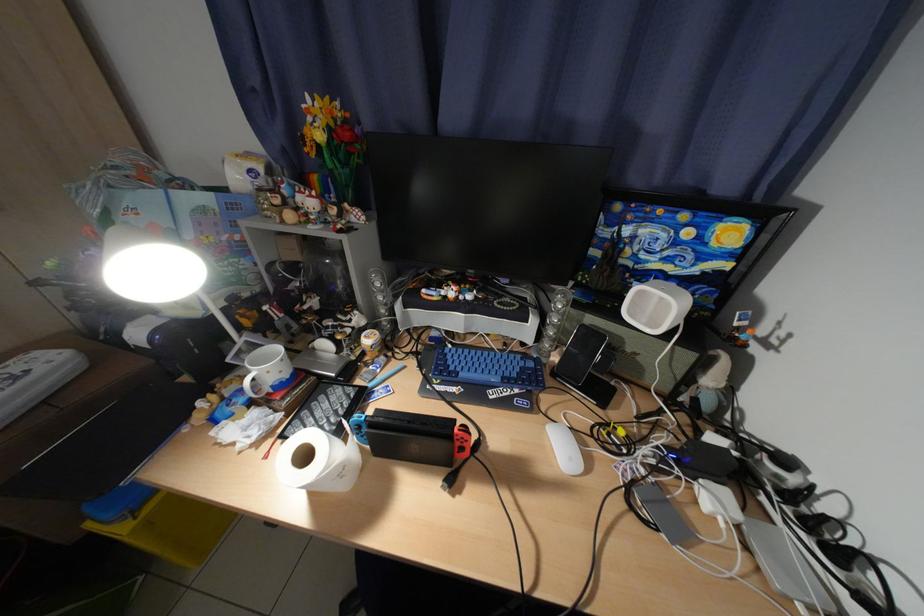
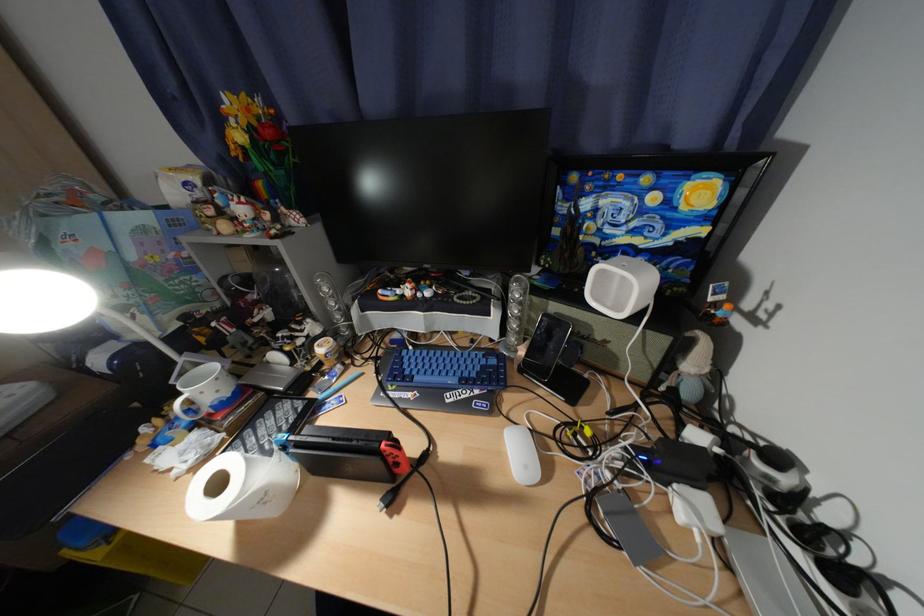
Where in the second image is the point corresponding to point (749, 516) from the first image?

(728, 528)